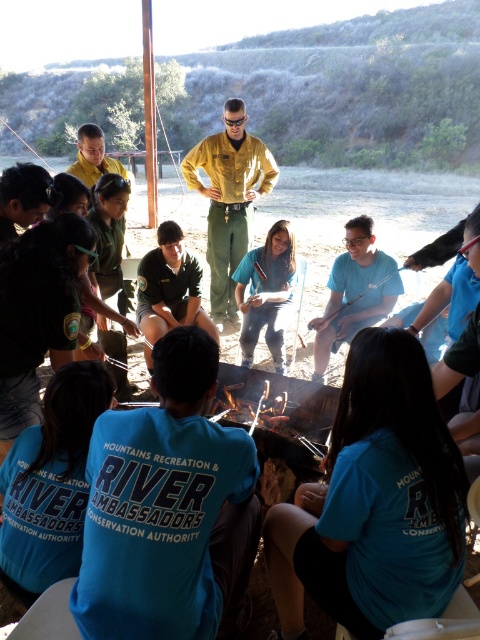
Does blue cotton shirt at center have a lesser height compared to yellow uniform at center?

Yes.

Does blue cotton shirt at center have a smaller size compared to yellow uniform at center?

Indeed, blue cotton shirt at center has a smaller size compared to yellow uniform at center.

This screenshot has width=480, height=640. What do you see at coordinates (168, 509) in the screenshot? I see `blue cotton shirt at center` at bounding box center [168, 509].

Locate an element on the screen. blue cotton shirt at center is located at coordinates (168, 509).

Between blue t-shirt at center and blue fabric shirt at center, which one is positioned higher?

Positioned higher is blue fabric shirt at center.

Can you confirm if blue t-shirt at center is bigger than blue fabric shirt at center?

Indeed, blue t-shirt at center has a larger size compared to blue fabric shirt at center.

The height and width of the screenshot is (640, 480). What are the coordinates of `blue t-shirt at center` in the screenshot? It's located at (354, 292).

Which is more to the right, blue cotton shirt at center or matte blue shirt at center?

From the viewer's perspective, matte blue shirt at center appears more on the right side.

The width and height of the screenshot is (480, 640). What do you see at coordinates (168, 509) in the screenshot? I see `blue cotton shirt at center` at bounding box center [168, 509].

This screenshot has height=640, width=480. I want to click on blue cotton shirt at center, so click(168, 509).